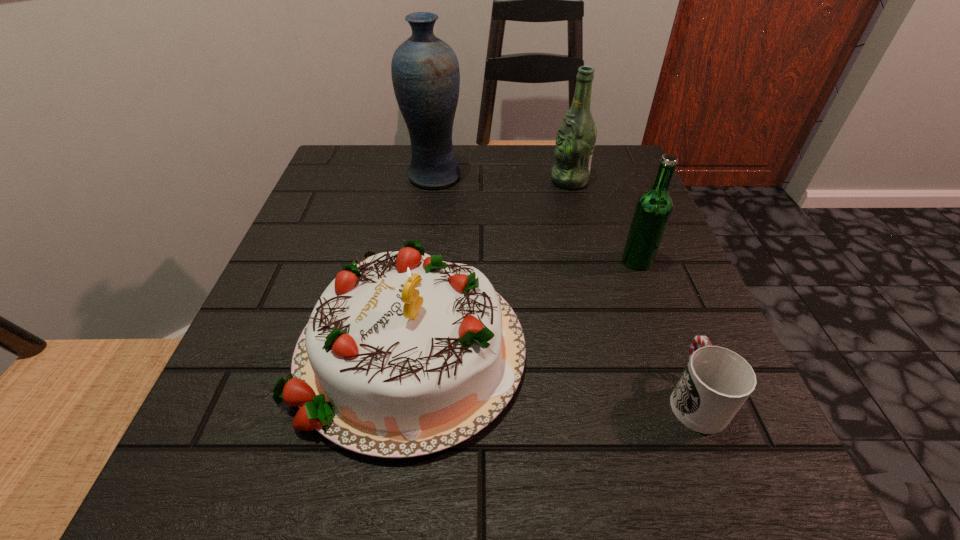
The width and height of the screenshot is (960, 540). Identify the location of blank region between the shortest object and the shorter beer bottle. (666, 329).

Find the location of a particular element. The width and height of the screenshot is (960, 540). vacant space that is in between the tallest object and the left beer bottle is located at coordinates (502, 179).

The height and width of the screenshot is (540, 960). I want to click on empty space between the vase and the cup, so click(x=564, y=287).

Where is `empty space between the cake and the shorter beer bottle`? The image size is (960, 540). empty space between the cake and the shorter beer bottle is located at coordinates (524, 303).

In order to click on blank region between the cake and the left beer bottle in this screenshot , I will do `click(491, 263)`.

The image size is (960, 540). I want to click on vacant area that lies between the cake and the shortest object, so click(553, 372).

Where is `unoccupied area between the cup and the tallest object`? unoccupied area between the cup and the tallest object is located at coordinates (564, 287).

The height and width of the screenshot is (540, 960). Find the location of `free spot between the cake and the nearer beer bottle`. free spot between the cake and the nearer beer bottle is located at coordinates (524, 303).

Where is `object that is the third closest one to the cake`? The image size is (960, 540). object that is the third closest one to the cake is located at coordinates click(x=425, y=72).

Locate which object ranks second in proximity to the shortest object. Please provide its 2D coordinates. Your answer should be formatted as a tuple, i.e. [(x, y)], where the tuple contains the x and y coordinates of a point satisfying the conditions above.

[(653, 209)]